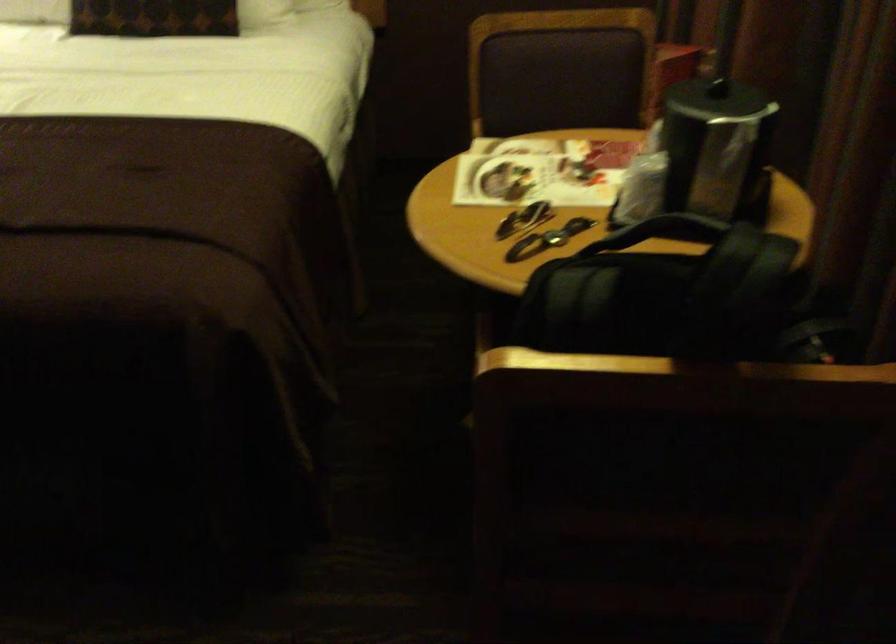
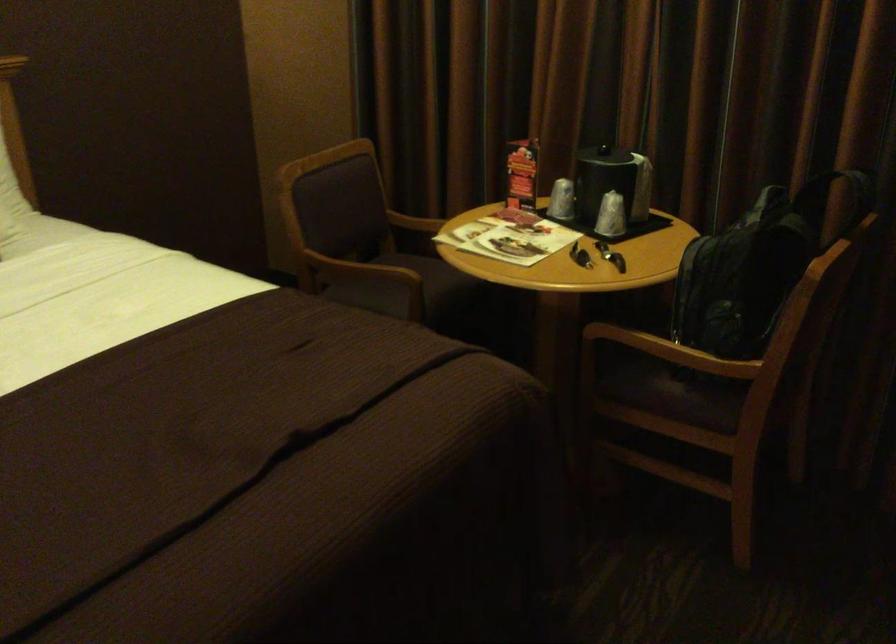
Locate, in the second image, the point that corresponds to (x=615, y=315) in the first image.

(757, 259)